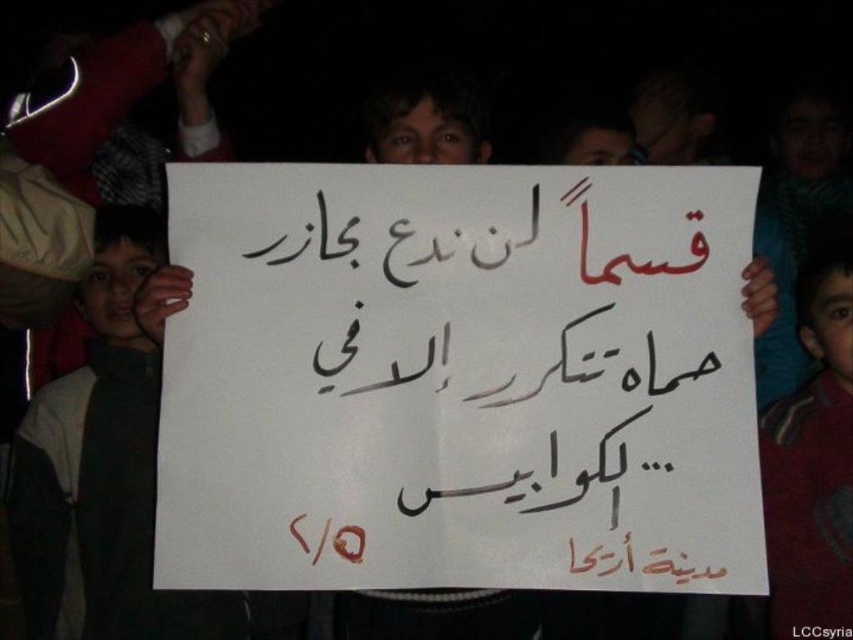
You are a photographer who wants to capture a clear photo of the white paper sign at center and the maroon fabric shirt at right. Given that the sign is wider than the shirt, which object should you focus on to ensure both are in frame without cropping?

Since the white paper sign at center is wider than the maroon fabric shirt at right, you should focus on the white paper sign at center to ensure both objects fit within the frame without cropping.

What is the relationship between the white paper sign at center and the maroon fabric shirt at right in terms of their positions?

The white paper sign at center is positioned over the maroon fabric shirt at right, meaning it is placed above and covering part of the shirt.